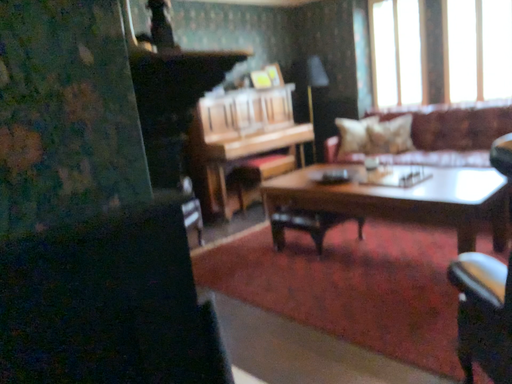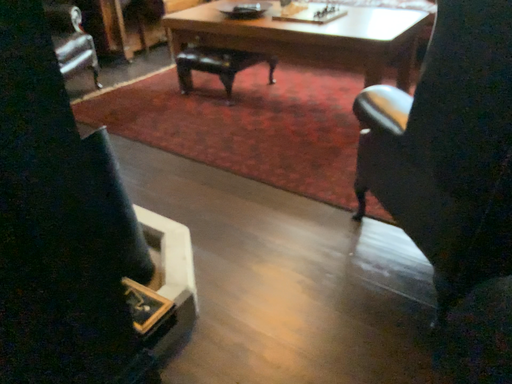
Question: Which way did the camera rotate in the video?

Choices:
 (A) rotated left
 (B) rotated right

Answer: (B)